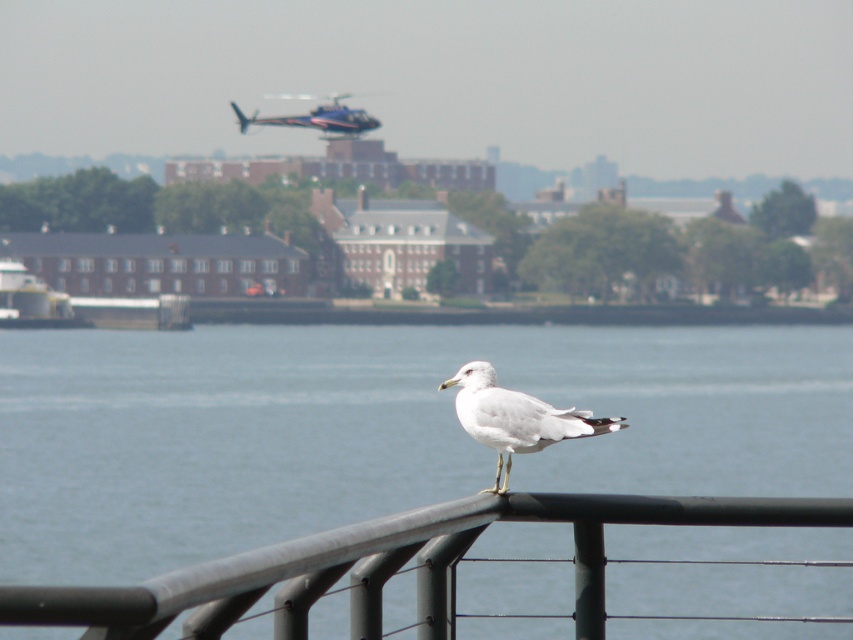
Question: In this image, where is clear blue water at center located relative to blue metallic helicopter at upper center?

Choices:
 (A) right
 (B) left

Answer: (A)

Question: Can you confirm if clear blue water at center is thinner than white feathered bird at center?

Choices:
 (A) no
 (B) yes

Answer: (A)

Question: Which point appears closest to the camera in this image?

Choices:
 (A) (358, 124)
 (B) (433, 512)
 (C) (485, 408)
 (D) (677, 358)

Answer: (B)

Question: Which object is closer to the camera taking this photo?

Choices:
 (A) black metal fence at lower center
 (B) clear blue water at center
 (C) blue metallic helicopter at upper center

Answer: (B)

Question: Which object is the farthest from the clear blue water at center?

Choices:
 (A) black metal fence at lower center
 (B) blue metallic helicopter at upper center
 (C) white feathered bird at center

Answer: (A)

Question: Does clear blue water at center appear on the right side of blue metallic helicopter at upper center?

Choices:
 (A) no
 (B) yes

Answer: (B)